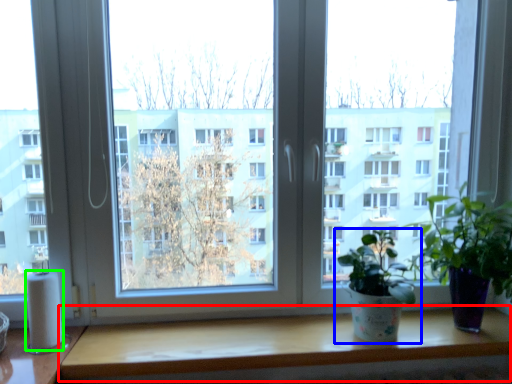
Question: Estimate the real-world distances between objects in this image. Which object is closer to table (highlighted by a red box), houseplant (highlighted by a blue box) or toilet paper (highlighted by a green box)?

Choices:
 (A) houseplant
 (B) toilet paper

Answer: (A)